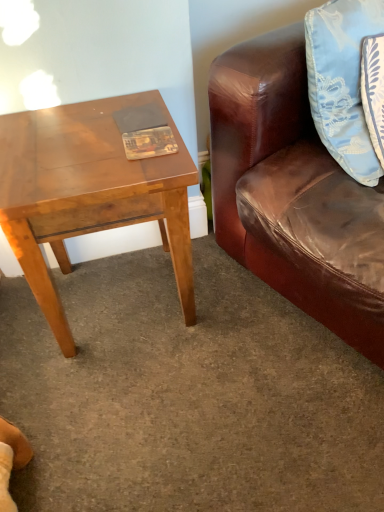
Question: Considering the relative positions of light brown wooden table at left and light blue satin pillow at upper right in the image provided, is light brown wooden table at left to the right of light blue satin pillow at upper right from the viewer's perspective?

Choices:
 (A) yes
 (B) no

Answer: (B)

Question: From the image's perspective, is light brown wooden table at left located above light blue satin pillow at upper right?

Choices:
 (A) yes
 (B) no

Answer: (B)

Question: Does light brown wooden table at left touch light blue satin pillow at upper right?

Choices:
 (A) no
 (B) yes

Answer: (A)

Question: Is light brown wooden table at left oriented away from light blue satin pillow at upper right?

Choices:
 (A) no
 (B) yes

Answer: (A)

Question: Can you confirm if light brown wooden table at left is bigger than light blue satin pillow at upper right?

Choices:
 (A) yes
 (B) no

Answer: (A)

Question: Considering the relative sizes of light brown wooden table at left and light blue satin pillow at upper right in the image provided, is light brown wooden table at left thinner than light blue satin pillow at upper right?

Choices:
 (A) no
 (B) yes

Answer: (A)

Question: From the image's perspective, does matte plastic book at center appear lower than light blue satin pillow at upper right?

Choices:
 (A) yes
 (B) no

Answer: (A)

Question: From the image's perspective, is matte plastic book at center on top of light blue satin pillow at upper right?

Choices:
 (A) yes
 (B) no

Answer: (B)

Question: Could you tell me if matte plastic book at center is turned towards light blue satin pillow at upper right?

Choices:
 (A) no
 (B) yes

Answer: (A)

Question: Would you say light blue satin pillow at upper right is part of matte plastic book at center's contents?

Choices:
 (A) yes
 (B) no

Answer: (B)

Question: Can you confirm if matte plastic book at center is shorter than light blue satin pillow at upper right?

Choices:
 (A) no
 (B) yes

Answer: (B)

Question: Is matte plastic book at center positioned with its back to light blue satin pillow at upper right?

Choices:
 (A) yes
 (B) no

Answer: (B)

Question: Is matte plastic book at center to the right of light brown wooden table at left from the viewer's perspective?

Choices:
 (A) yes
 (B) no

Answer: (A)